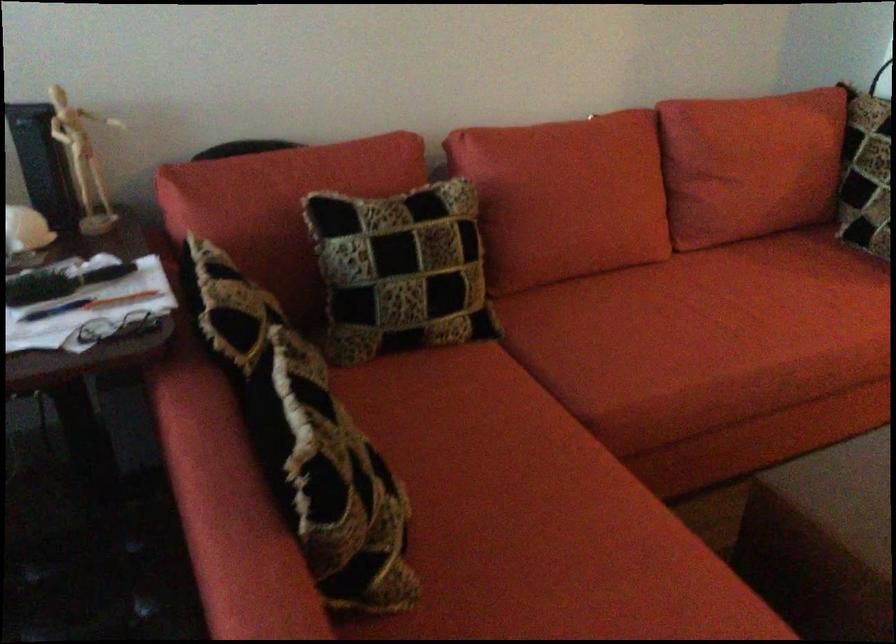
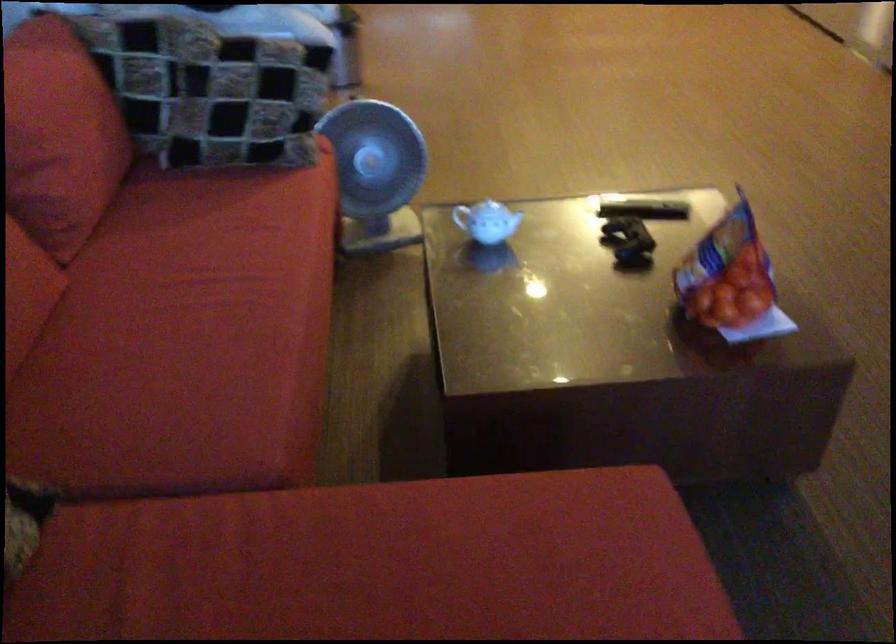
Find the pixel in the second image that matches point 682,315 in the first image.

(192, 330)